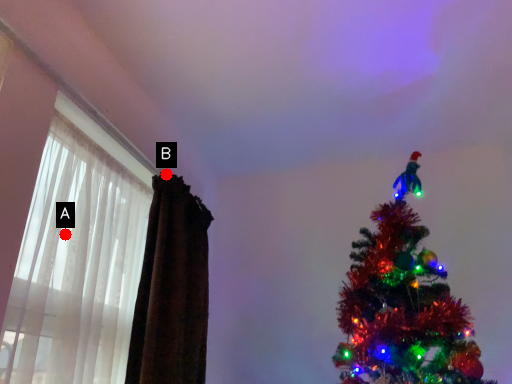
Question: Two points are circled on the image, labeled by A and B beside each circle. Which point is closer to the camera?

Choices:
 (A) A is closer
 (B) B is closer

Answer: (A)